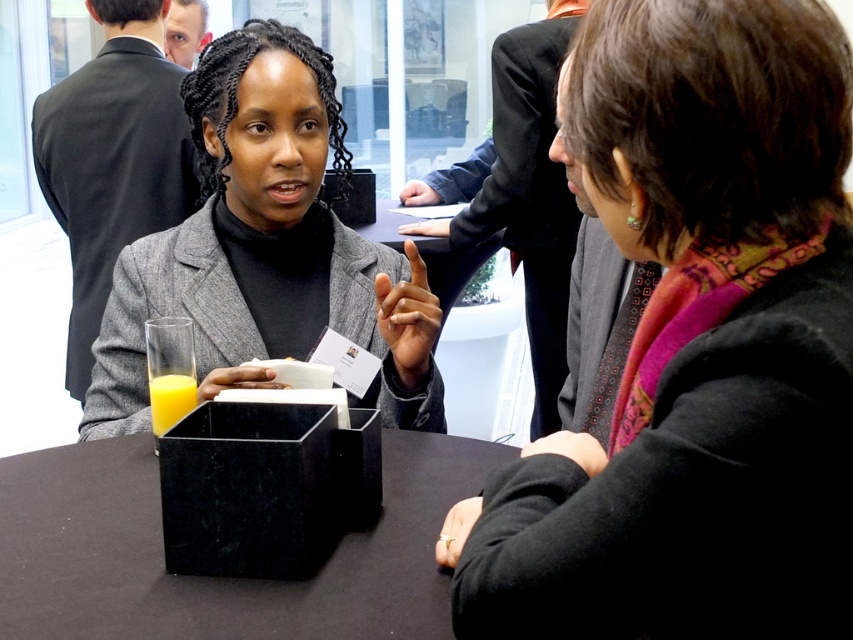
Does matte black napkin at center have a lesser height compared to matte black hand at upper center?

Correct, matte black napkin at center is not as tall as matte black hand at upper center.

From the picture: Is matte black napkin at center taller than matte black hand at upper center?

Incorrect, matte black napkin at center's height is not larger of matte black hand at upper center's.

Does point (268, 381) come closer to viewer compared to point (405, 227)?

That is True.

This screenshot has width=853, height=640. What are the coordinates of `matte black napkin at center` in the screenshot? It's located at (236, 380).

From the picture: Which is more to the left, matte gray blazer at center or matte black hand at center?

matte gray blazer at center is more to the left.

Who is positioned more to the right, matte gray blazer at center or matte black hand at center?

Positioned to the right is matte black hand at center.

Describe the element at coordinates (267, 246) in the screenshot. The height and width of the screenshot is (640, 853). I see `matte gray blazer at center` at that location.

Locate an element on the screen. The height and width of the screenshot is (640, 853). matte gray blazer at center is located at coordinates (267, 246).

Who is positioned more to the left, black marble organizer at center or matte black napkin at center?

From the viewer's perspective, matte black napkin at center appears more on the left side.

Does black marble organizer at center appear under matte black napkin at center?

Yes.

Consider the image. Who is more distant from viewer, (312, 440) or (215, 390)?

Point (215, 390)

Where is `black marble organizer at center`? This screenshot has width=853, height=640. black marble organizer at center is located at coordinates (265, 486).